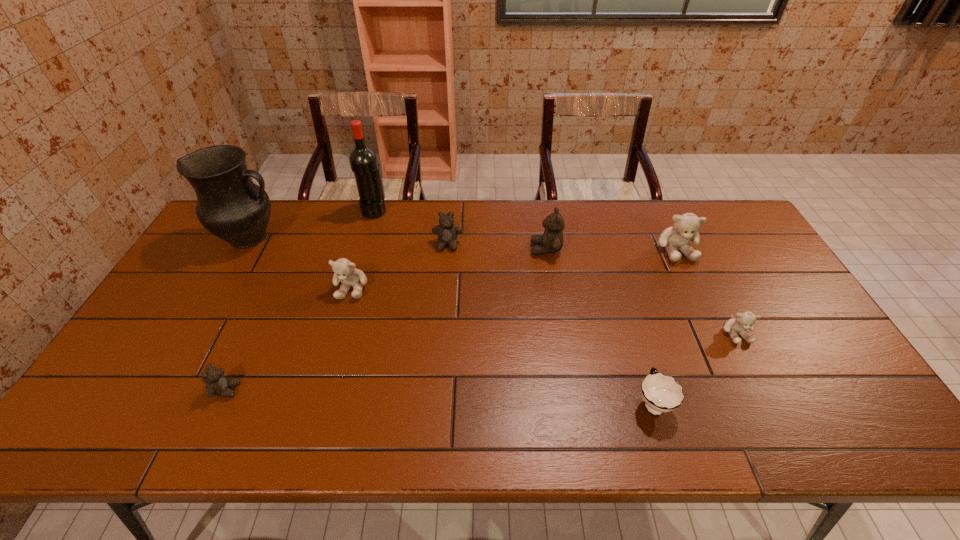
Where is `wine bottle`? Image resolution: width=960 pixels, height=540 pixels. wine bottle is located at coordinates (363, 161).

Where is `the second tallest object`? the second tallest object is located at coordinates [230, 205].

Where is `the leftmost object`? The height and width of the screenshot is (540, 960). the leftmost object is located at coordinates (230, 205).

Locate an element on the screen. This screenshot has width=960, height=540. the fourth object from right to left is located at coordinates (551, 241).

Find the location of a particular element. The width and height of the screenshot is (960, 540). the rightmost brown teddy bear is located at coordinates (551, 241).

The height and width of the screenshot is (540, 960). I want to click on the biggest gray teddy bear, so click(x=685, y=227).

The image size is (960, 540). I want to click on the fourth teddy bear from right to left, so click(447, 232).

This screenshot has width=960, height=540. Identify the location of the second biggest brown teddy bear. (447, 232).

You are a GUI agent. You are given a task and a screenshot of the screen. Output one action in this format:
    pyautogui.click(x=<x>, y=<y>)
    Task: Click on the leftmost gray teddy bear
    This screenshot has width=960, height=540.
    Given the screenshot: What is the action you would take?
    pyautogui.click(x=344, y=270)

I want to click on the fifth teddy bear from right to left, so click(x=344, y=270).